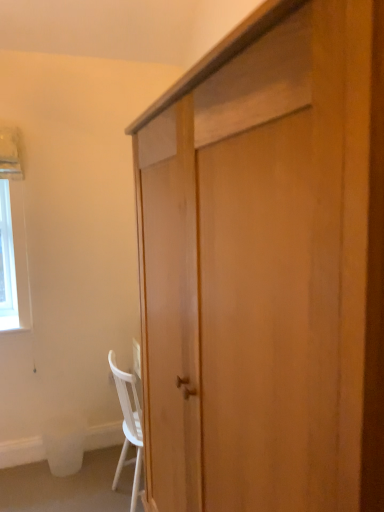
Question: Is light wood cabinet at center positioned in front of white plastic trash bin at lower left?

Choices:
 (A) no
 (B) yes

Answer: (B)

Question: Can you confirm if light wood cabinet at center is taller than white plastic trash bin at lower left?

Choices:
 (A) yes
 (B) no

Answer: (A)

Question: From a real-world perspective, is light wood cabinet at center located beneath white plastic trash bin at lower left?

Choices:
 (A) no
 (B) yes

Answer: (A)

Question: Are light wood cabinet at center and white plastic trash bin at lower left located far from each other?

Choices:
 (A) no
 (B) yes

Answer: (B)

Question: Is light wood cabinet at center bigger than white plastic trash bin at lower left?

Choices:
 (A) yes
 (B) no

Answer: (A)

Question: From the image's perspective, is light wood cabinet at center above or below white plastic trash bin at lower left?

Choices:
 (A) below
 (B) above

Answer: (B)

Question: From a real-world perspective, relative to white plastic trash bin at lower left, is light wood cabinet at center vertically above or below?

Choices:
 (A) below
 (B) above

Answer: (B)

Question: Is point pyautogui.click(x=168, y=399) closer or farther from the camera than point pyautogui.click(x=62, y=429)?

Choices:
 (A) closer
 (B) farther

Answer: (A)

Question: From their relative heights in the image, would you say light wood cabinet at center is taller or shorter than white plastic trash bin at lower left?

Choices:
 (A) short
 (B) tall

Answer: (B)

Question: Is point (124, 377) positioned closer to the camera than point (271, 272)?

Choices:
 (A) closer
 (B) farther

Answer: (B)

Question: In terms of size, does white matte chair at lower left appear bigger or smaller than light wood cabinet at center?

Choices:
 (A) small
 (B) big

Answer: (A)

Question: From the image's perspective, is white matte chair at lower left located above or below light wood cabinet at center?

Choices:
 (A) below
 (B) above

Answer: (A)

Question: From a real-world perspective, relative to light wood cabinet at center, is white matte chair at lower left vertically above or below?

Choices:
 (A) below
 (B) above

Answer: (A)

Question: Would you say white plastic trash bin at lower left is inside or outside light wood cabinet at center?

Choices:
 (A) inside
 (B) outside

Answer: (B)

Question: Looking at their shapes, would you say white plastic trash bin at lower left is wider or thinner than light wood cabinet at center?

Choices:
 (A) wide
 (B) thin

Answer: (B)